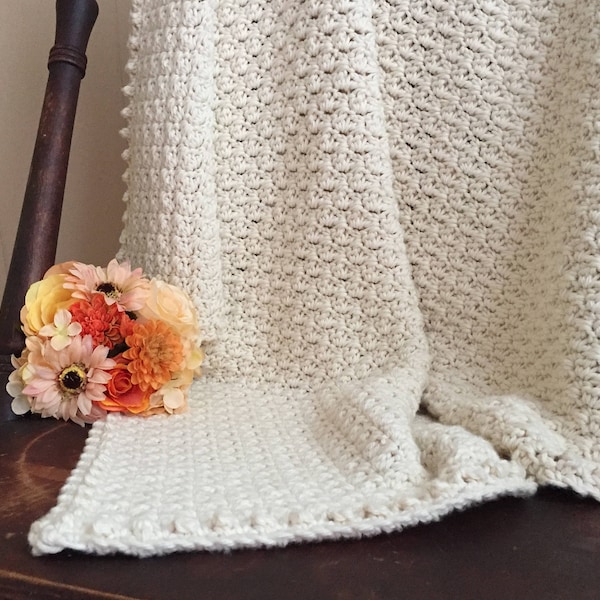
Find the location of a particular element. cloth is located at coordinates (240, 477).